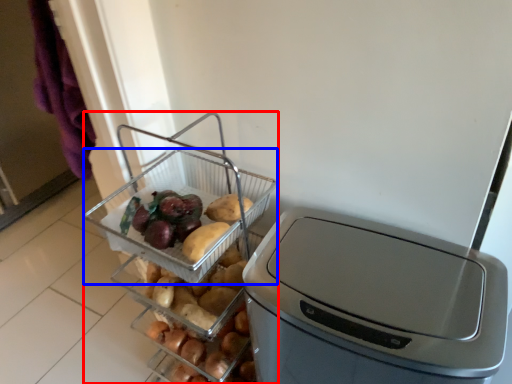
Question: Which object is further to the camera taking this photo, appliance (highlighted by a red box) or basket (highlighted by a blue box)?

Choices:
 (A) appliance
 (B) basket

Answer: (B)